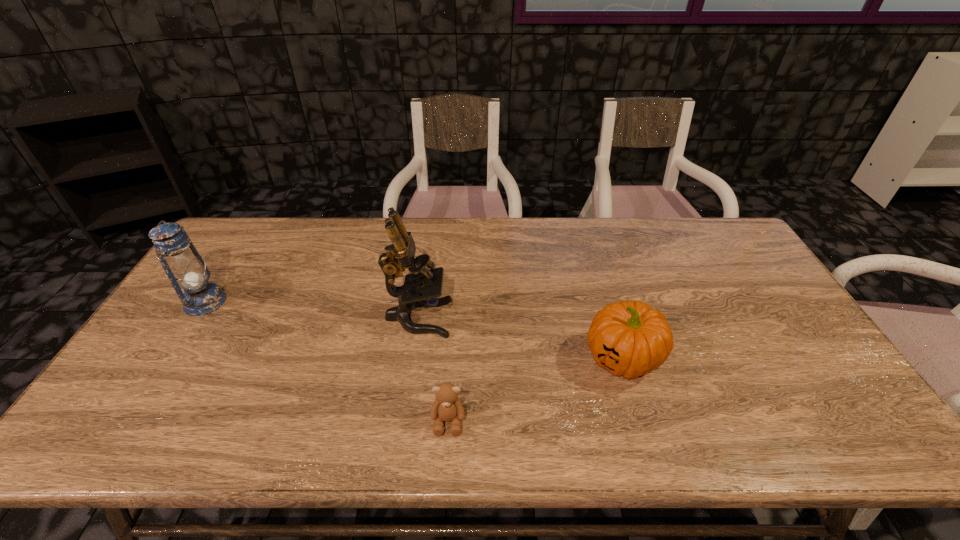
This screenshot has width=960, height=540. Find the location of `free area in between the leftmost object and the microscope`. free area in between the leftmost object and the microscope is located at coordinates (312, 309).

Identify the location of free space that is in between the microscope and the leftmost object. (312, 309).

Find the location of `empty space that is in between the shortest object and the leftmost object`. empty space that is in between the shortest object and the leftmost object is located at coordinates (326, 361).

Where is `unoccupied area between the lantern and the microscope`? The image size is (960, 540). unoccupied area between the lantern and the microscope is located at coordinates (312, 309).

Identify the location of vacant area that lies between the tallest object and the rightmost object. This screenshot has height=540, width=960. (520, 338).

Where is `vacant region between the microscope and the lantern`? vacant region between the microscope and the lantern is located at coordinates (312, 309).

Identify which object is the nearest to the microscope. Please provide its 2D coordinates. Your answer should be formatted as a tuple, i.e. [(x, y)], where the tuple contains the x and y coordinates of a point satisfying the conditions above.

[(447, 407)]

I want to click on object identified as the second closest to the shortest object, so click(x=630, y=339).

Identify the location of free space in the image that satisfies the following two spatial constraints: 1. on the surface of the pumpkin; 2. on the front-facing side of the teddy bear. (640, 421).

Where is `vacant area that satisfies the following two spatial constraints: 1. on the surface of the pumpkin; 2. on the front-facing side of the shortest object`? The width and height of the screenshot is (960, 540). vacant area that satisfies the following two spatial constraints: 1. on the surface of the pumpkin; 2. on the front-facing side of the shortest object is located at coordinates (640, 421).